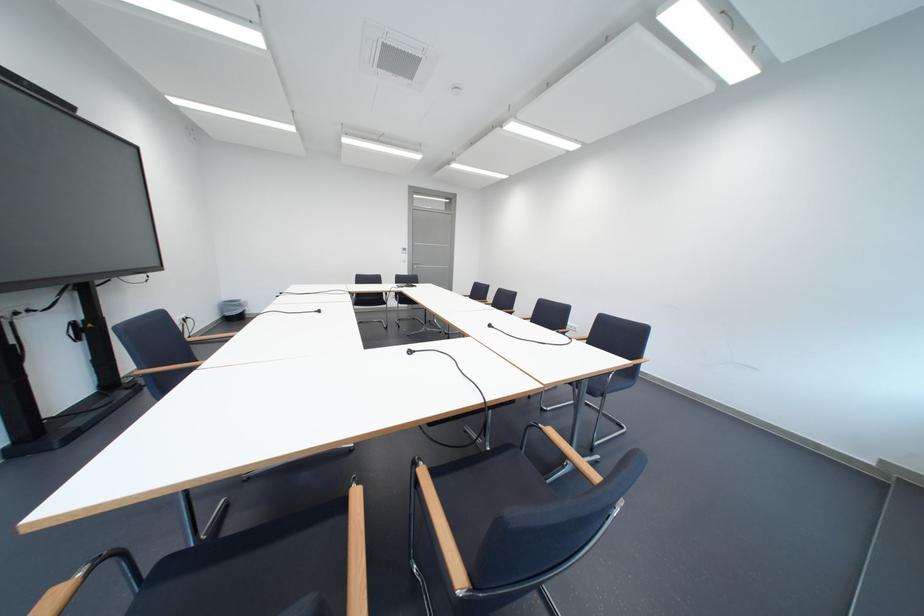
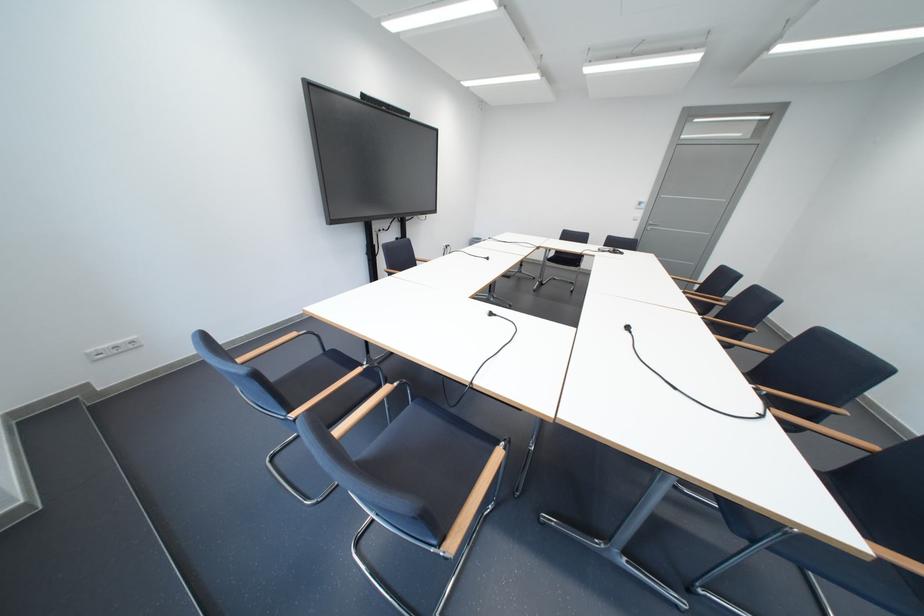
The point at (426, 265) is marked in the first image. Where is the corresponding point in the second image?

(660, 227)